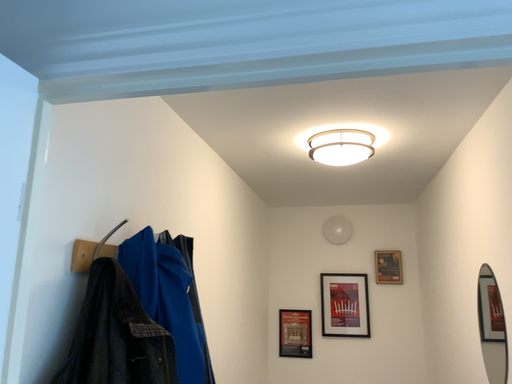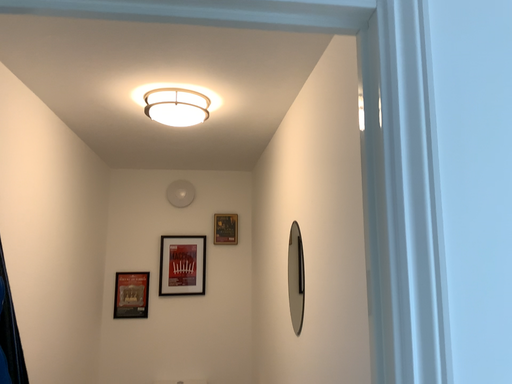
Question: How did the camera likely rotate when shooting the video?

Choices:
 (A) rotated right
 (B) rotated left

Answer: (A)